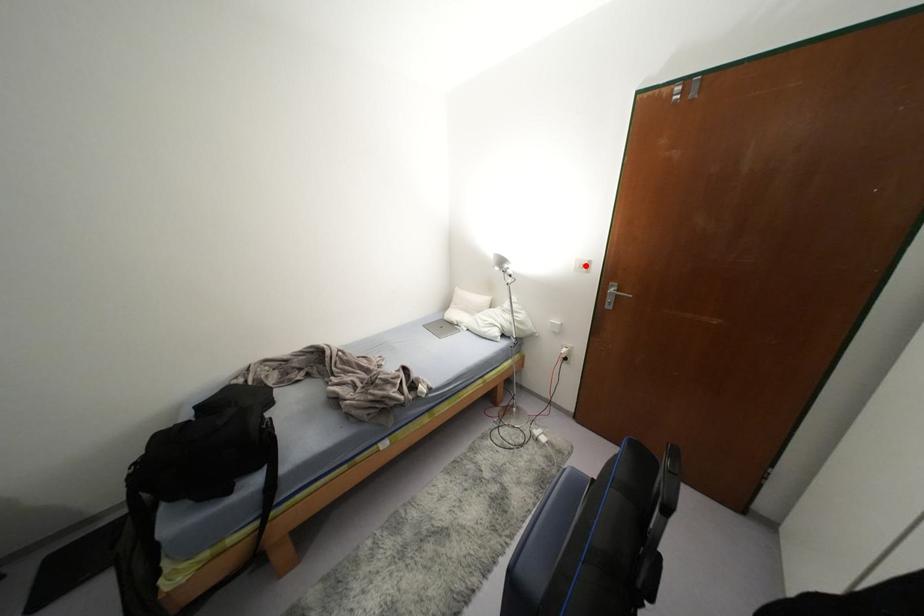
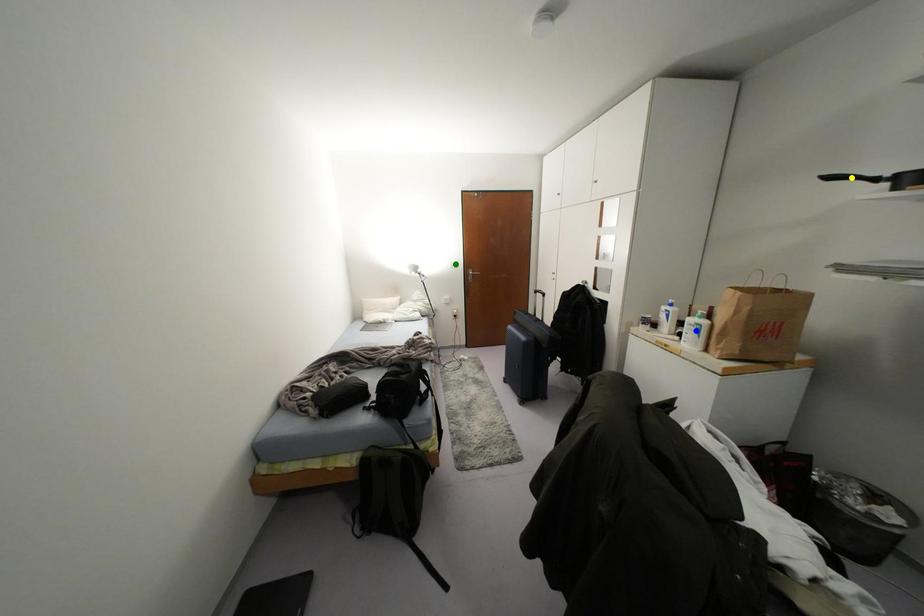
Question: I am providing you with two images of the same scene from different viewpoints. A red point is marked on the first image. You are given multiple points on the second image. Can you choose the point in image 2 that corresponds to the point in image 1?

Choices:
 (A) green point
 (B) yellow point
 (C) blue point

Answer: (A)